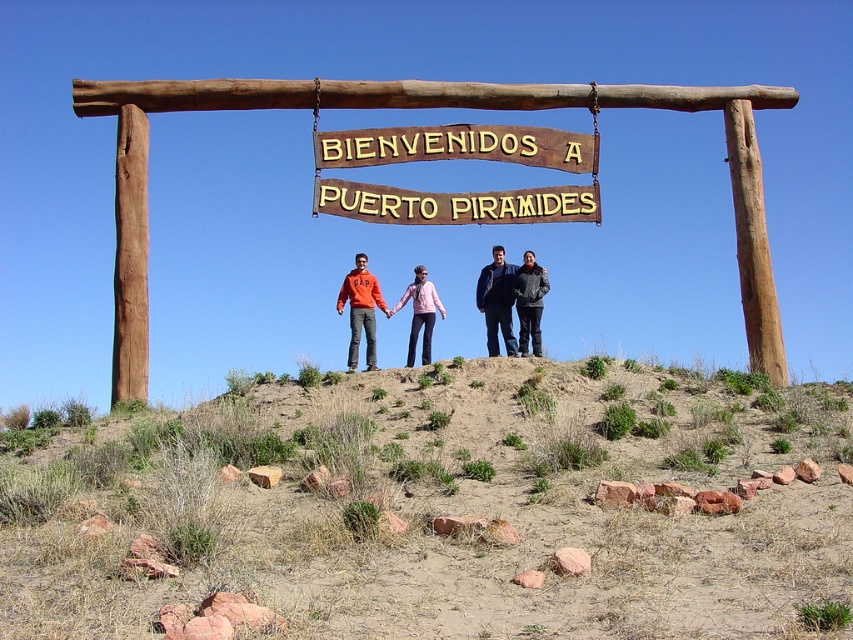
In the scene shown: You are a photographer trying to capture a group photo under the wooden archway. You notice the dried grass at center and the dark blue jacket at center. Which object is wider in the scene?

The dried grass at center might be wider than dark blue jacket at center according to the description.